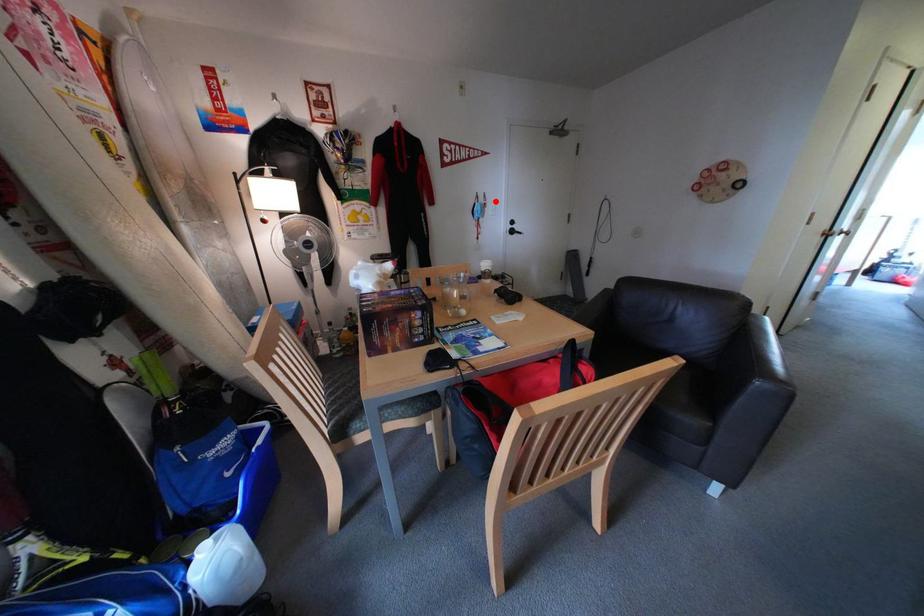
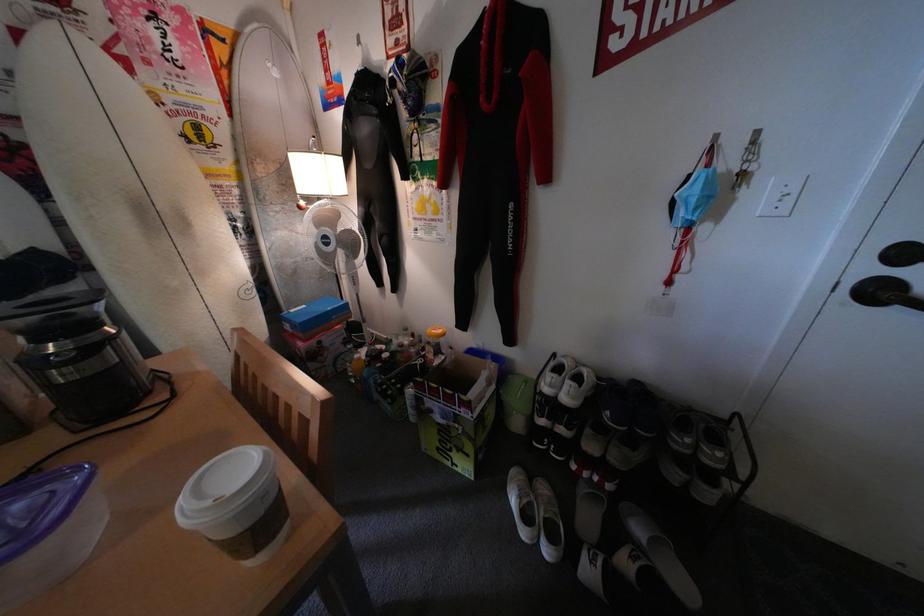
Locate, in the second image, the point that corresponds to the highlighted location in the first image.

(744, 161)